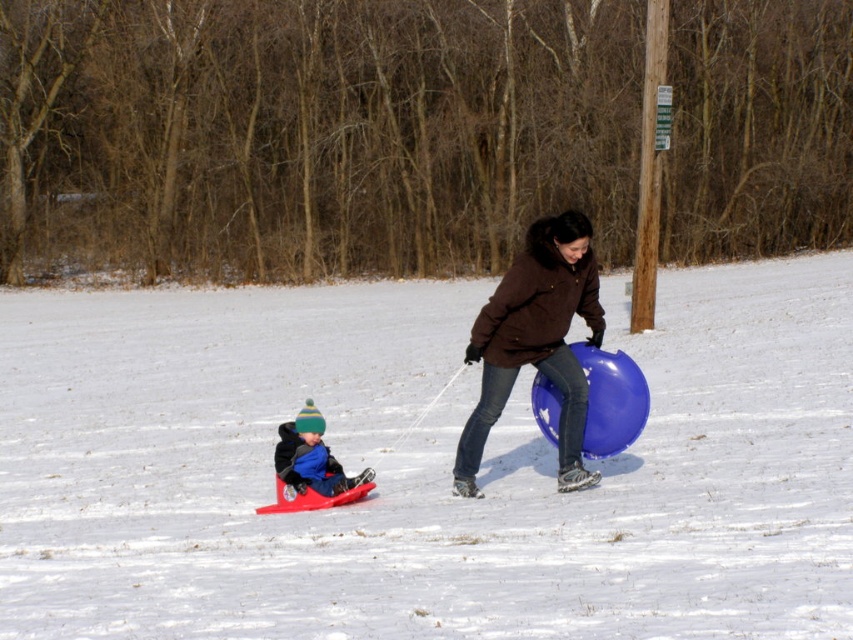
Question: Is the position of brown fuzzy coat at center less distant than that of blue fleece jacket at lower left?

Choices:
 (A) no
 (B) yes

Answer: (B)

Question: Estimate the real-world distances between objects in this image. Which object is closer to the white matte snow at center?

Choices:
 (A) brown fuzzy coat at center
 (B) blue fleece jacket at lower left

Answer: (B)

Question: Based on their relative distances, which object is nearer to the white matte snow at center?

Choices:
 (A) blue fleece jacket at lower left
 (B) brown fuzzy coat at center

Answer: (A)

Question: Is white matte snow at center thinner than brown fuzzy coat at center?

Choices:
 (A) yes
 (B) no

Answer: (B)

Question: From the image, what is the correct spatial relationship of brown fuzzy coat at center in relation to blue fleece jacket at lower left?

Choices:
 (A) below
 (B) above

Answer: (B)

Question: Which point is closer to the camera?

Choices:
 (A) (297, 492)
 (B) (549, 324)
 (C) (801, 428)

Answer: (B)